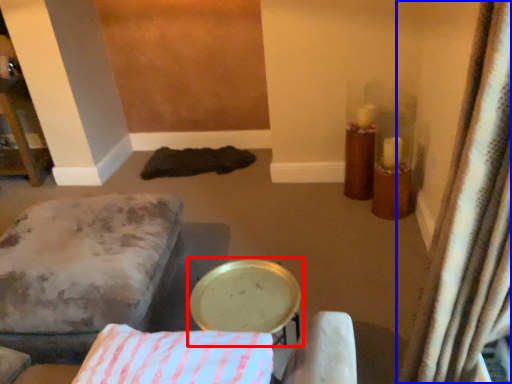
Question: Which of the following is the closest to the observer, round table (highlighted by a red box) or curtain (highlighted by a blue box)?

Choices:
 (A) round table
 (B) curtain

Answer: (B)